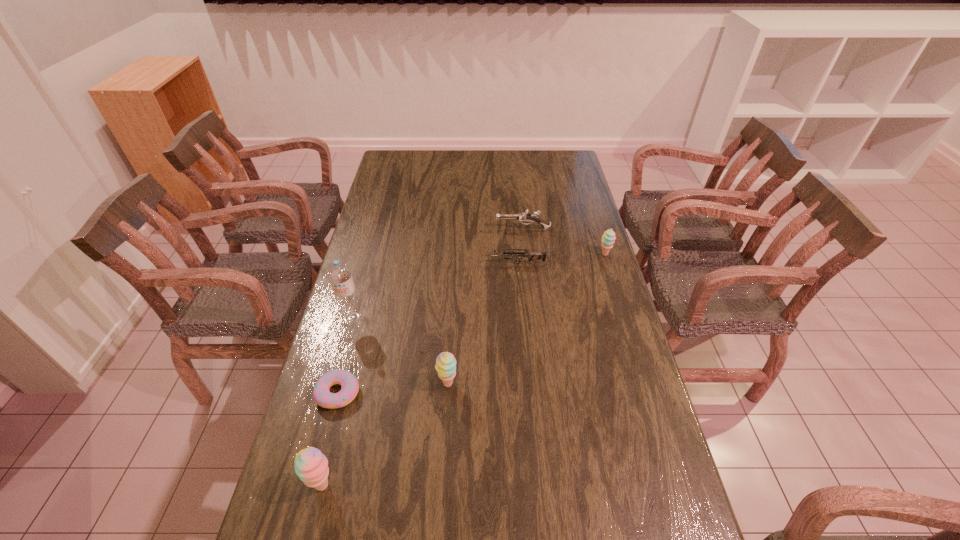
To make them evenly spaced by inserting another sherbert among them, please locate a free space for this new sherbert. Please provide its 2D coordinates. Your answer should be formatted as a tuple, i.e. [(x, y)], where the tuple contains the x and y coordinates of a point satisfying the conditions above.

[(537, 310)]